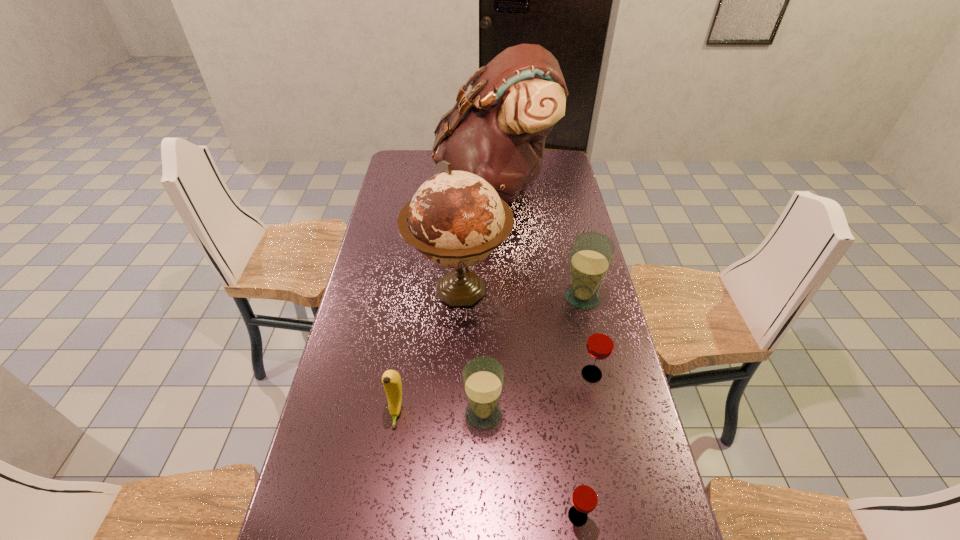
In order to click on the nearer red glass in this screenshot , I will do `click(585, 496)`.

Find the location of a particular element. the smaller red glass is located at coordinates (585, 496).

In order to click on free region located at the front of the farthest object with buckles in this screenshot , I will do `click(403, 188)`.

You are a GUI agent. You are given a task and a screenshot of the screen. Output one action in this format:
    pyautogui.click(x=<x>, y=<y>)
    Task: Click on the vacant space located 0.130m at the front of the farthest object with buckles
    This screenshot has width=960, height=540.
    Given the screenshot: What is the action you would take?
    pyautogui.click(x=406, y=188)

I want to click on blank space located 0.220m at the front of the farthest object with buckles, so click(385, 188).

Locate an element on the screen. This screenshot has height=540, width=960. vacant position located on the front of the sixth shortest object showing Asia is located at coordinates (453, 422).

You are a GUI agent. You are given a task and a screenshot of the screen. Output one action in this format:
    pyautogui.click(x=<x>, y=<y>)
    Task: Click on the free space located on the front of the farther blue glass
    Image resolution: width=960 pixels, height=540 pixels.
    Given the screenshot: What is the action you would take?
    pyautogui.click(x=588, y=324)

Locate an element on the screen. blank area located on the front of the farther red glass is located at coordinates (610, 456).

I want to click on vacant space situated on the right of the leftmost glass, so (553, 413).

This screenshot has height=540, width=960. Find the location of `free space located from the stem of the banana`. free space located from the stem of the banana is located at coordinates (386, 483).